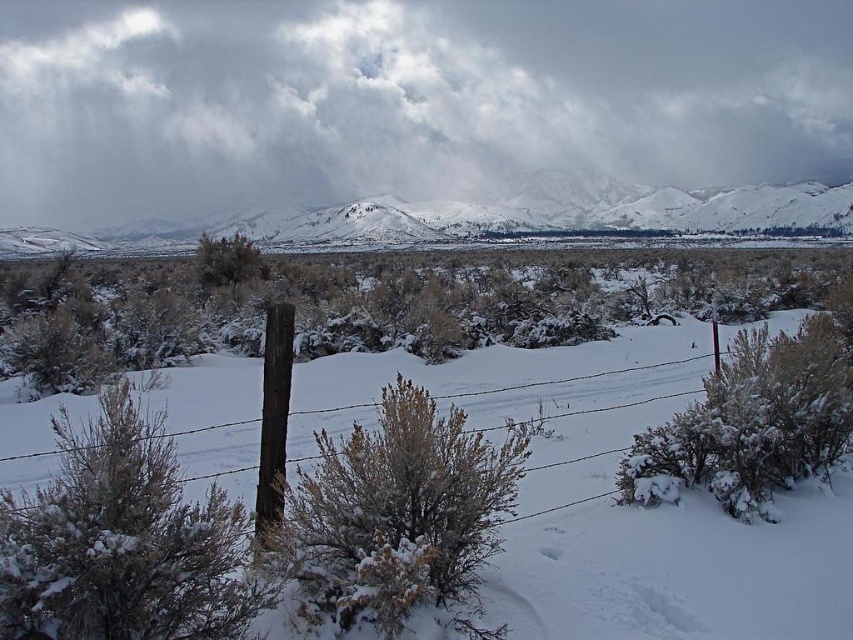
You are an observer standing in the winter landscape. You notice the white fluffy bush at left and the brown textured bush at center. Which bush is shorter?

The white fluffy bush at left is shorter than the brown textured bush at center.

You are a photographer setting up a shot of the winter landscape. You want to frame the white fluffy bush at left and the brown textured bush at center so that both are visible in the composition. Given their sizes, which bush should you place closer to the edge of the frame to avoid overcrowding?

The white fluffy bush at left has a lesser width compared to the brown textured bush at center, so you should place the wider brown textured bush at center closer to the edge to prevent it from dominating the frame and overcrowding the smaller bush.

Based on the photo, you are standing in the winter landscape and want to walk from the point closer to you to the point further away. Which path would you take between the two points, point (97,596) and point (721,380)?

You should take the path from point (97,596) to point (721,380) since point (97,596) is closer to you and the other is further away, so moving from near to far would be the correct path.